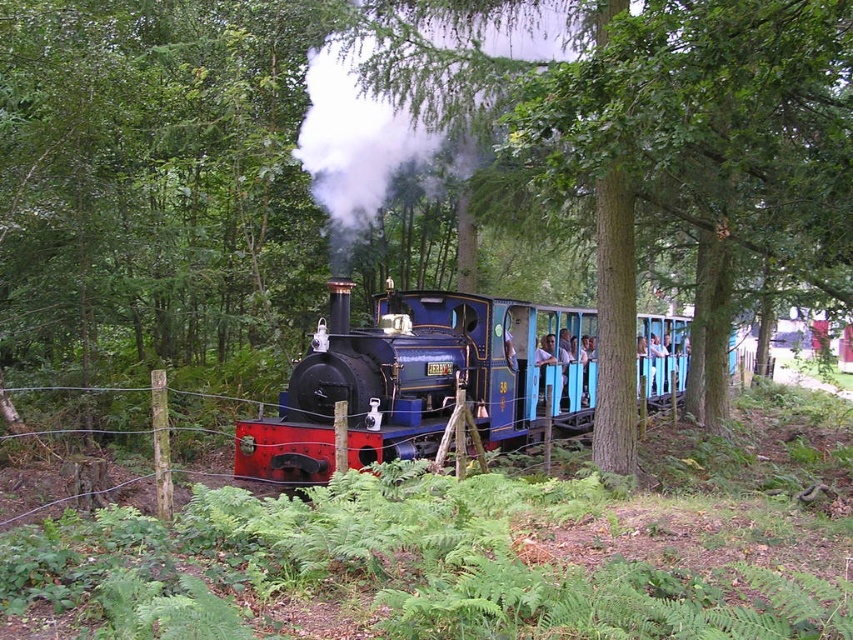
Between polished black locomotive at center and wire mesh fence at center, which one is positioned higher?

A: polished black locomotive at center is higher up.

Where is `polished black locomotive at center`? This screenshot has width=853, height=640. polished black locomotive at center is located at coordinates (383, 385).

Identify the location of polished black locomotive at center. The height and width of the screenshot is (640, 853). (383, 385).

Can you confirm if shiny blue locomotive at center is smaller than polished black locomotive at center?

Incorrect, shiny blue locomotive at center is not smaller in size than polished black locomotive at center.

Can you confirm if shiny blue locomotive at center is positioned below polished black locomotive at center?

Incorrect, shiny blue locomotive at center is not positioned below polished black locomotive at center.

Identify the location of shiny blue locomotive at center. (422, 380).

Is shiny blue locomotive at center bigger than wire mesh fence at center?

Incorrect, shiny blue locomotive at center is not larger than wire mesh fence at center.

Measure the distance between shiny blue locomotive at center and camera.

A distance of 9.29 meters exists between shiny blue locomotive at center and camera.

Image resolution: width=853 pixels, height=640 pixels. Identify the location of shiny blue locomotive at center. (422, 380).